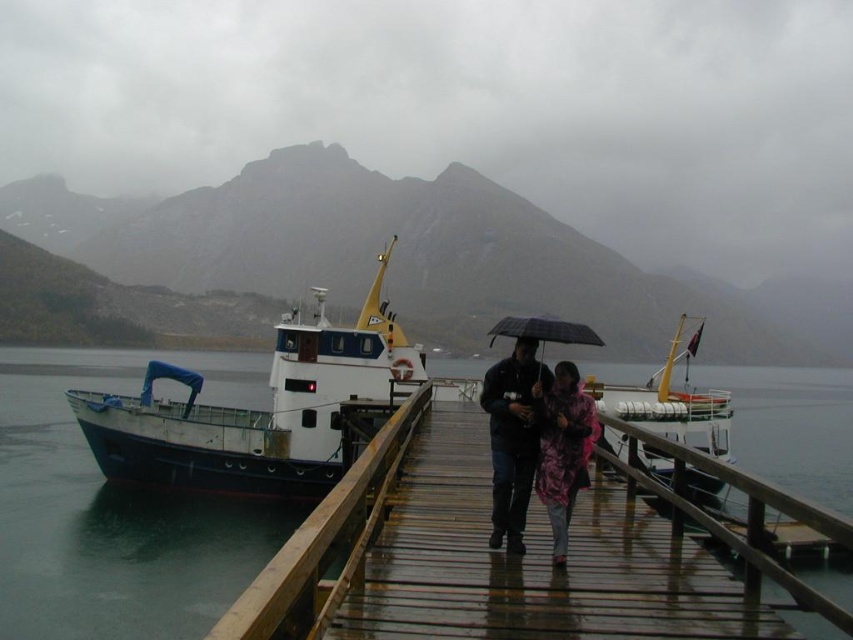
In the scene shown: Does wooden at center have a larger size compared to blue painted metal boat at center?

Actually, wooden at center might be smaller than blue painted metal boat at center.

Measure the distance between point (622, 557) and camera.

The distance of point (622, 557) from camera is 39.52 feet.

Locate an element on the screen. wooden at center is located at coordinates (477, 556).

Does wooden at center have a smaller size compared to camouflage jacket at center?

Incorrect, wooden at center is not smaller in size than camouflage jacket at center.

Who is positioned more to the right, wooden at center or camouflage jacket at center?

camouflage jacket at center is more to the right.

Measure the distance between wooden at center and camera.

wooden at center and camera are 4.47 meters apart from each other.

At what (x,y) coordinates should I click in order to perform the action: click on wooden at center. Please return your answer as a coordinate pair (x, y). The width and height of the screenshot is (853, 640). Looking at the image, I should click on (477, 556).

Is point (567, 512) farther from camera compared to point (492, 330)?

No, (567, 512) is closer to viewer.

Can you confirm if camouflage jacket at center is shorter than black matte umbrella at center?

No.

Which is behind, point (563, 525) or point (517, 332)?

The point (517, 332) is more distant.

In order to click on camouflage jacket at center in this screenshot , I will do `click(534, 442)`.